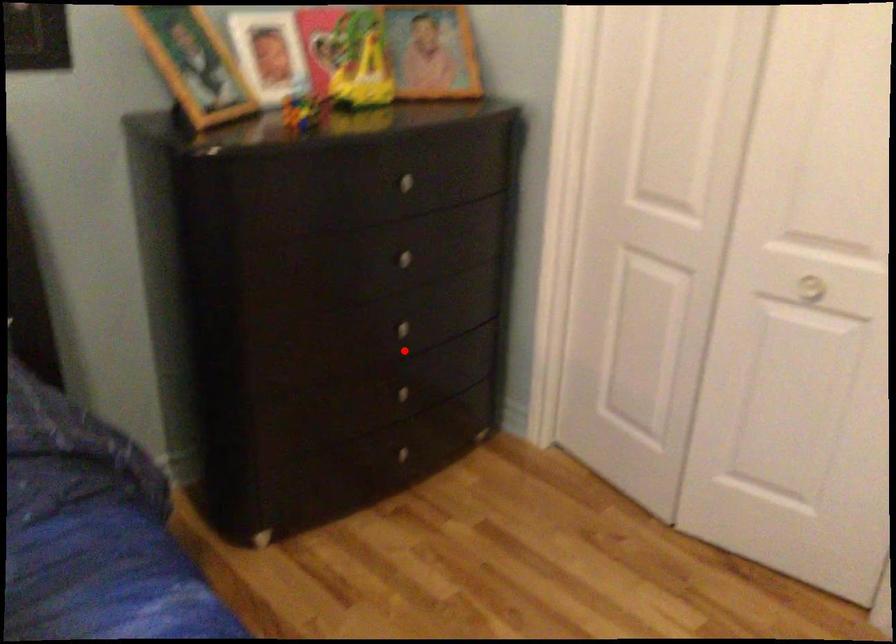
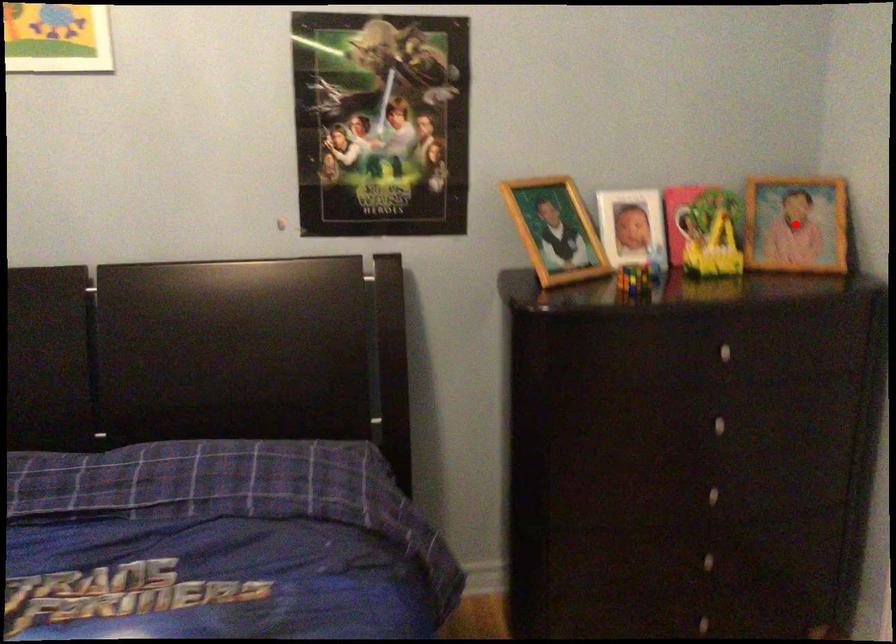
I am providing you with two images of the same scene from different viewpoints. A red point is marked on the first image and another point is marked on the second image. Are the points marked in image1 and image2 representing the same 3D position?

No